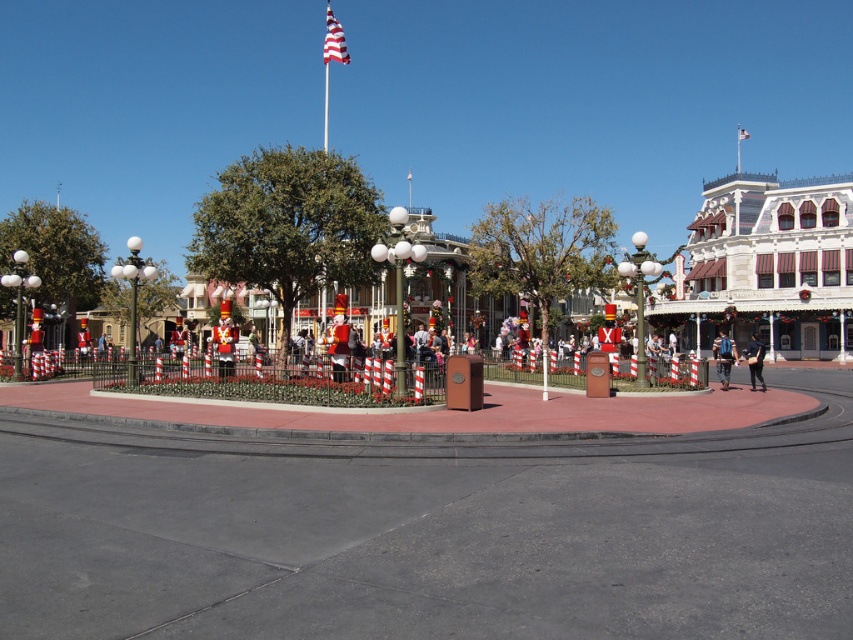
Question: Among these points, which one is nearest to the camera?

Choices:
 (A) (323, 35)
 (B) (746, 138)

Answer: (B)

Question: Does american flag at upper center appear under american flag at center?

Choices:
 (A) no
 (B) yes

Answer: (A)

Question: Which point appears farthest from the camera in this image?

Choices:
 (A) (334, 51)
 (B) (753, 340)
 (C) (740, 138)

Answer: (C)

Question: Does blue denim jeans at lower right have a greater width compared to metallic flag pole at upper center?

Choices:
 (A) yes
 (B) no

Answer: (B)

Question: Which of the following is the closest to the observer?

Choices:
 (A) black leather jacket at center
 (B) metallic flag pole at upper center
 (C) american flag at upper center
 (D) blue denim jeans at lower right

Answer: (A)

Question: From the image, what is the correct spatial relationship of blue denim jeans at lower right in relation to metallic flag pole at upper center?

Choices:
 (A) below
 (B) above

Answer: (A)